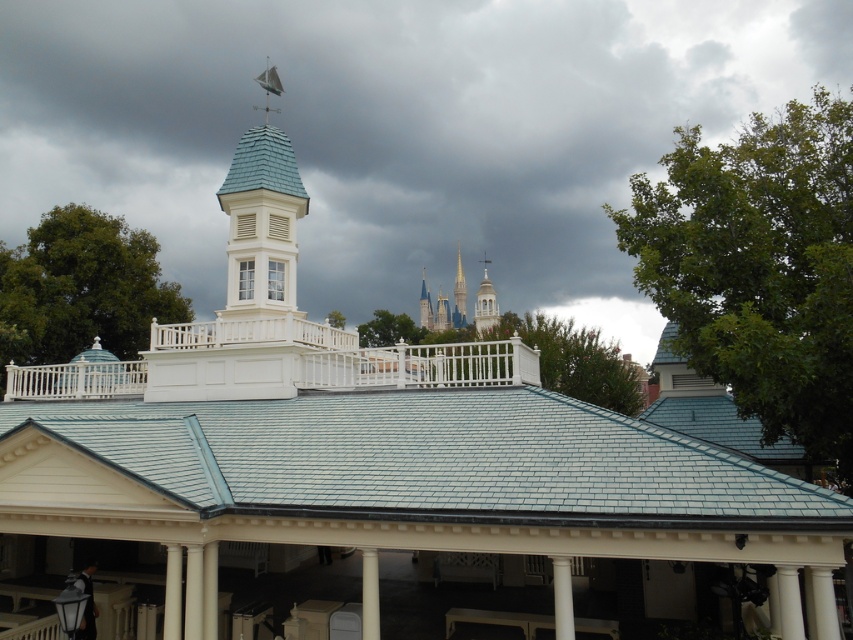
Is point (634, 64) farther from camera compared to point (570, 612)?

Yes.

Can you confirm if gray cloudy sky at upper center is thinner than white glossy column at center?

No.

The height and width of the screenshot is (640, 853). In order to click on gray cloudy sky at upper center in this screenshot , I will do `click(396, 131)`.

Find the location of a particular element. The image size is (853, 640). gray cloudy sky at upper center is located at coordinates (396, 131).

Can you confirm if golden spires at center is shorter than white stucco tower at center?

In fact, golden spires at center may be taller than white stucco tower at center.

Does point (440, 305) come in front of point (488, 320)?

No, it is behind (488, 320).

This screenshot has width=853, height=640. What are the coordinates of `golden spires at center` in the screenshot? It's located at (444, 304).

Which of these two, gray cloudy sky at upper center or white painted wood porch at center, stands taller?

gray cloudy sky at upper center

Does gray cloudy sky at upper center appear on the right side of white painted wood porch at center?

Correct, you'll find gray cloudy sky at upper center to the right of white painted wood porch at center.

Find the location of a particular element. gray cloudy sky at upper center is located at coordinates (396, 131).